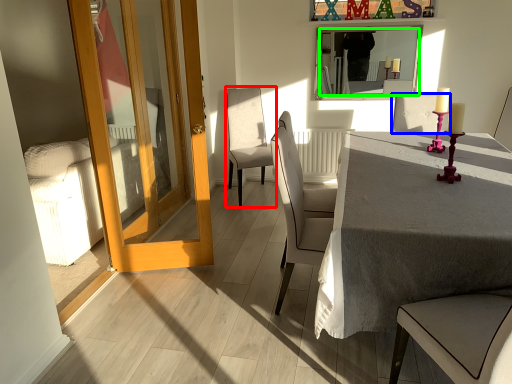
Question: Which object is positioned closest to chair (highlighted by a red box)? Select from chair (highlighted by a blue box) and mirror (highlighted by a green box).

Choices:
 (A) chair
 (B) mirror

Answer: (B)